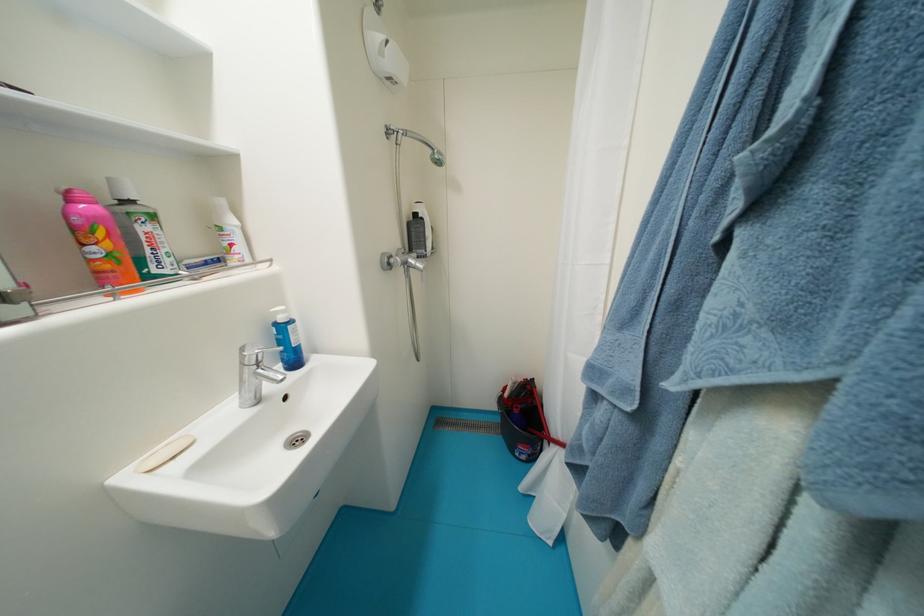
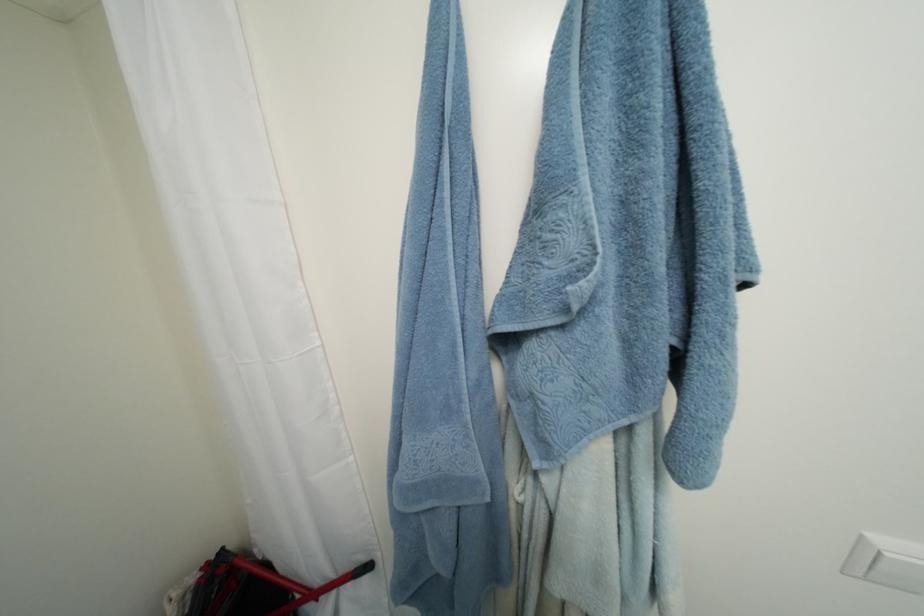
Locate, in the second image, the point that corresponds to pixel 540 381 in the first image.

(229, 552)